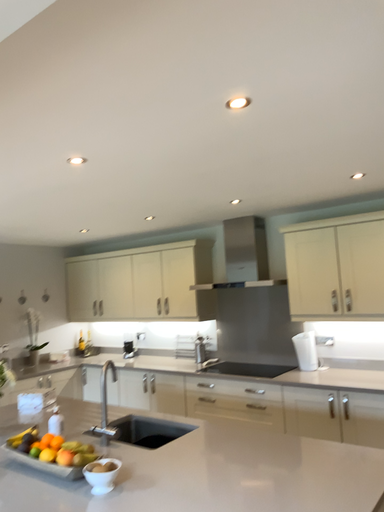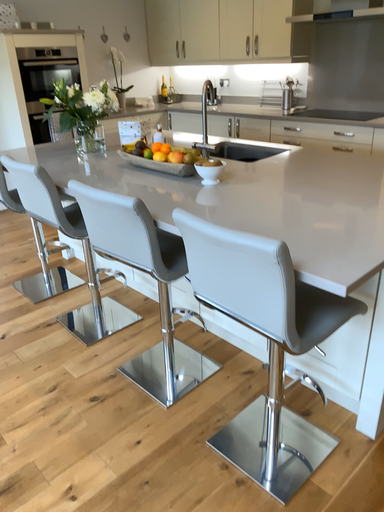
Question: Which way did the camera rotate in the video?

Choices:
 (A) rotated left
 (B) rotated right

Answer: (A)